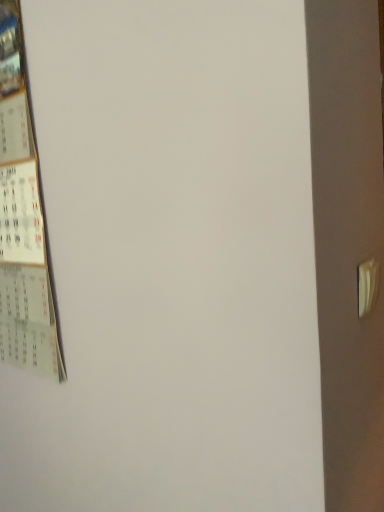
Question: Considering the positions of white plastic door handle at right and white paper calendar at left in the image, is white plastic door handle at right bigger or smaller than white paper calendar at left?

Choices:
 (A) big
 (B) small

Answer: (B)

Question: Considering the positions of point (362, 304) and point (31, 249), is point (362, 304) closer or farther from the camera than point (31, 249)?

Choices:
 (A) farther
 (B) closer

Answer: (B)

Question: From the image's perspective, is white plastic door handle at right positioned above or below white paper calendar at left?

Choices:
 (A) above
 (B) below

Answer: (B)

Question: Relative to white plastic door handle at right, is white paper calendar at left in front or behind?

Choices:
 (A) front
 (B) behind

Answer: (B)

Question: Looking at the image, does white paper calendar at left seem bigger or smaller compared to white plastic door handle at right?

Choices:
 (A) big
 (B) small

Answer: (A)

Question: Is white paper calendar at left inside or outside of white plastic door handle at right?

Choices:
 (A) outside
 (B) inside

Answer: (A)

Question: Is white paper calendar at left to the left or to the right of white plastic door handle at right in the image?

Choices:
 (A) right
 (B) left

Answer: (B)